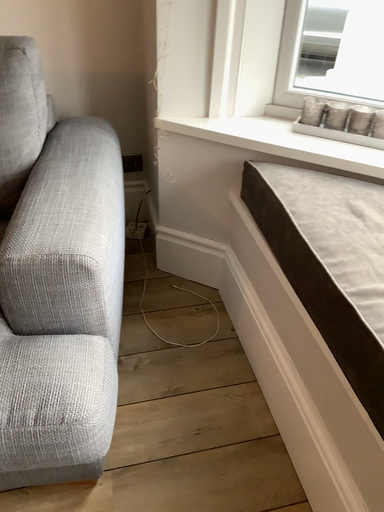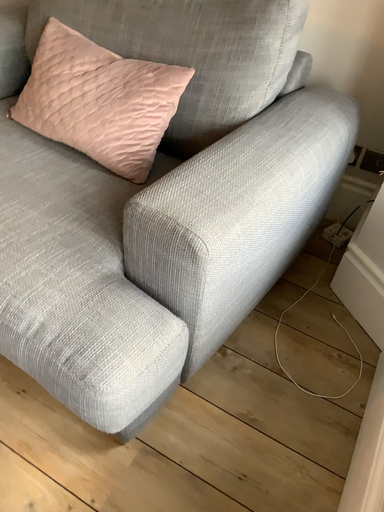
Question: Which way did the camera rotate in the video?

Choices:
 (A) rotated right
 (B) rotated left

Answer: (B)